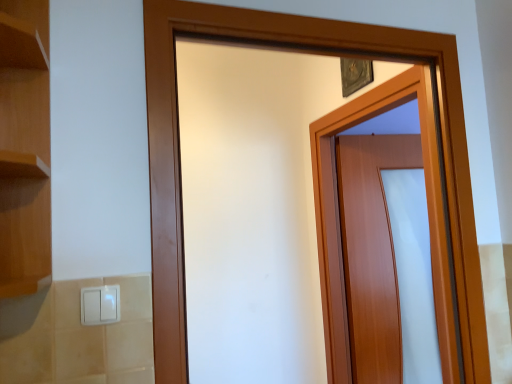
Question: Is wooden door at center, placed as the second door when sorted from back to front, positioned behind white plastic light switch at lower left?

Choices:
 (A) yes
 (B) no

Answer: (A)

Question: Can you confirm if wooden door at center, placed as the second door when sorted from back to front, is thinner than white plastic light switch at lower left?

Choices:
 (A) yes
 (B) no

Answer: (B)

Question: Is wooden door at center, arranged as the 1th door when viewed from the front, oriented away from white plastic light switch at lower left?

Choices:
 (A) yes
 (B) no

Answer: (B)

Question: Is wooden door at center, placed as the second door when sorted from back to front, positioned before white plastic light switch at lower left?

Choices:
 (A) no
 (B) yes

Answer: (A)

Question: Is wooden door at center, placed as the second door when sorted from back to front, oriented towards white plastic light switch at lower left?

Choices:
 (A) yes
 (B) no

Answer: (B)

Question: From the image's perspective, is wooden door at center, placed as the second door when sorted from back to front, on white plastic light switch at lower left?

Choices:
 (A) no
 (B) yes

Answer: (B)

Question: Considering the relative sizes of wooden door at center, which is counted as the 1th door, starting from the back, and wooden door at center, placed as the second door when sorted from back to front, in the image provided, is wooden door at center, which is counted as the 1th door, starting from the back, shorter than wooden door at center, placed as the second door when sorted from back to front,?

Choices:
 (A) yes
 (B) no

Answer: (B)

Question: Is wooden door at center, which is counted as the 1th door, starting from the back, outside of wooden door at center, placed as the second door when sorted from back to front?

Choices:
 (A) no
 (B) yes

Answer: (B)

Question: From the image's perspective, is wooden door at center, arranged as the 2th door when viewed from the front, located above wooden door at center, arranged as the 1th door when viewed from the front?

Choices:
 (A) yes
 (B) no

Answer: (B)

Question: Is there a large distance between wooden door at center, which is counted as the 1th door, starting from the back, and wooden door at center, arranged as the 1th door when viewed from the front?

Choices:
 (A) no
 (B) yes

Answer: (A)

Question: Considering the relative sizes of wooden door at center, which is counted as the 1th door, starting from the back, and wooden door at center, placed as the second door when sorted from back to front, in the image provided, is wooden door at center, which is counted as the 1th door, starting from the back, smaller than wooden door at center, placed as the second door when sorted from back to front,?

Choices:
 (A) yes
 (B) no

Answer: (B)

Question: Considering the relative positions of wooden door at center, which is counted as the 1th door, starting from the back, and wooden door at center, placed as the second door when sorted from back to front, in the image provided, is wooden door at center, which is counted as the 1th door, starting from the back, in front of wooden door at center, placed as the second door when sorted from back to front,?

Choices:
 (A) no
 (B) yes

Answer: (A)

Question: From a real-world perspective, is white plastic light switch at lower left beneath wooden door at center, which is counted as the 1th door, starting from the back?

Choices:
 (A) no
 (B) yes

Answer: (A)